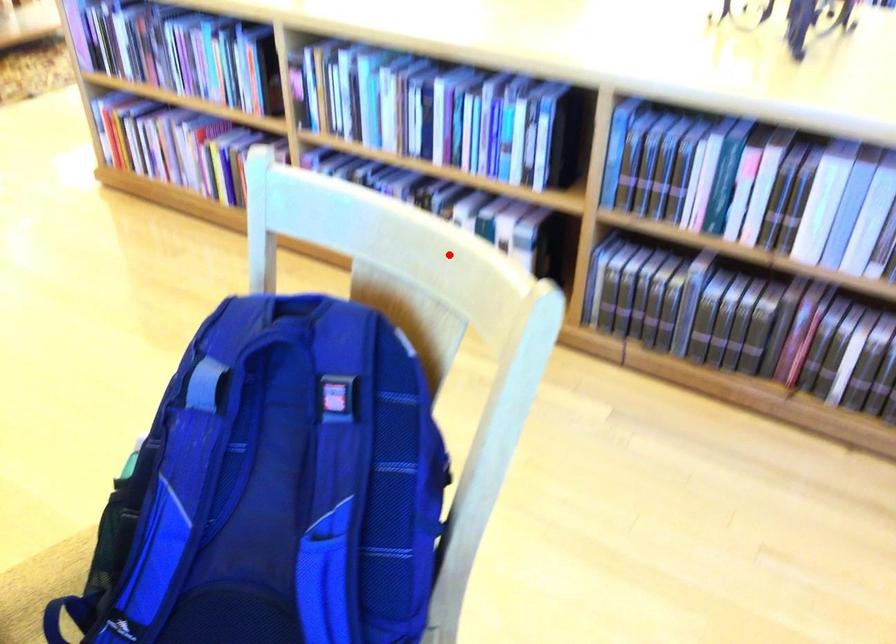
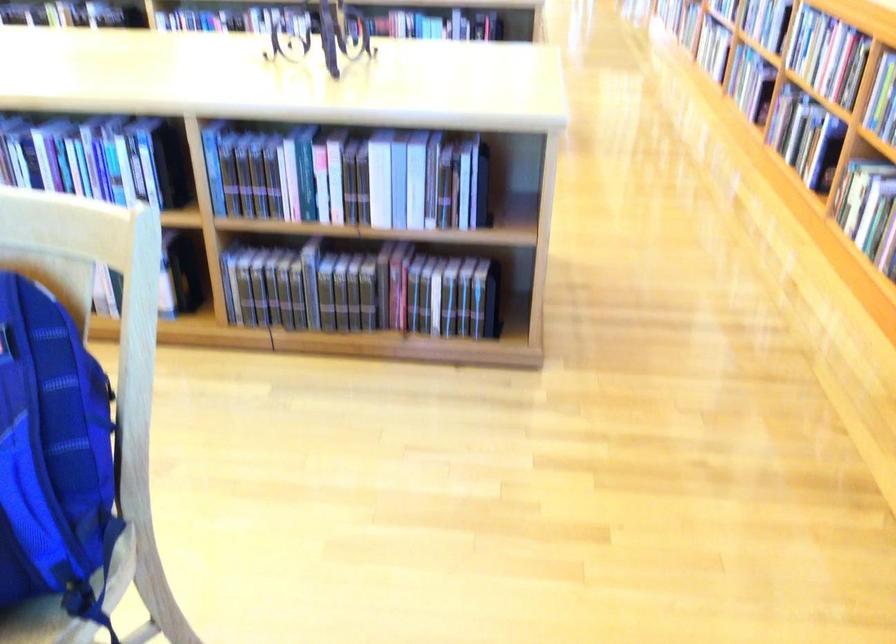
In the second image, find the point that corresponds to the highlighted location in the first image.

(67, 212)